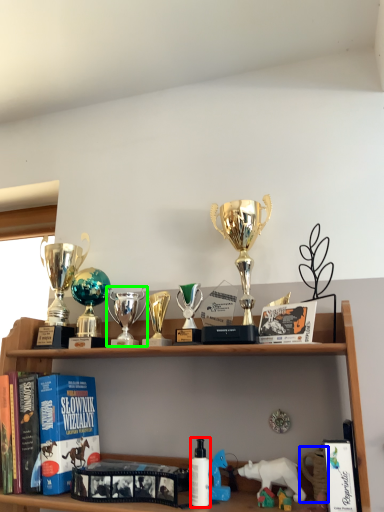
Question: Estimate the real-world distances between objects in this image. Which object is closer to toiletry (highlighted by a red box), toy (highlighted by a blue box) or toy (highlighted by a green box)?

Choices:
 (A) toy
 (B) toy

Answer: (A)